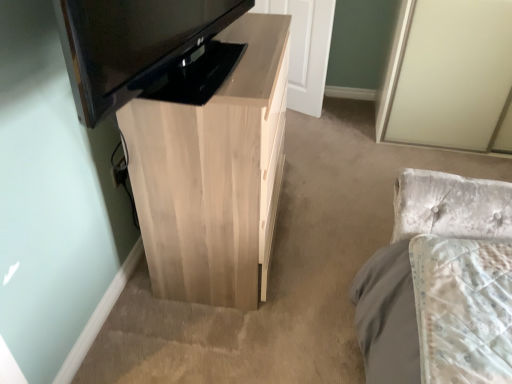
In order to face light wood cabinet at center, should I rotate leftwards or rightwards?

Turn left by 4.612 degrees to look at light wood cabinet at center.

The height and width of the screenshot is (384, 512). Identify the location of light wood cabinet at center. (214, 174).

Between white wood door at center and black glossy television at upper left, which one appears on the left side from the viewer's perspective?

Positioned to the left is black glossy television at upper left.

Is white wood door at center outside of black glossy television at upper left?

Yes, white wood door at center is located beyond the bounds of black glossy television at upper left.

Is white wood door at center taller than black glossy television at upper left?

Correct, white wood door at center is much taller as black glossy television at upper left.

Does point (305, 97) come behind point (133, 52)?

Yes, point (305, 97) is farther from viewer.

From the picture: Can light wood cabinet at center be found inside white wood door at center?

That's incorrect, light wood cabinet at center is not inside white wood door at center.

Is white wood door at center facing away from light wood cabinet at center?

white wood door at center does not have its back to light wood cabinet at center.

From a real-world perspective, is white wood door at center positioned over light wood cabinet at center based on gravity?

No, from a real-world perspective, white wood door at center is not above light wood cabinet at center.

Based on their sizes in the image, would you say light wood cabinet at center is bigger or smaller than white wood door at center?

Clearly, light wood cabinet at center is larger in size than white wood door at center.

From the image's perspective, does light wood cabinet at center appear higher than white wood door at center?

No, from the image's perspective, light wood cabinet at center is not over white wood door at center.

Considering the positions of points (222, 109) and (309, 37), is point (222, 109) farther from camera compared to point (309, 37)?

That is False.

Could white wood door at center be considered to be inside light wood cabinet at center?

No, white wood door at center is not inside light wood cabinet at center.

Based on the photo, is black glossy television at upper left positioned far away from white wood door at center?

black glossy television at upper left is far away from white wood door at center.

Is black glossy television at upper left positioned with its back to white wood door at center?

No, black glossy television at upper left is not facing the opposite direction of white wood door at center.

Does black glossy television at upper left have a greater height compared to white wood door at center?

No.

Which of these two, black glossy television at upper left or white wood door at center, is bigger?

black glossy television at upper left.

Which is closer, (x=242, y=180) or (x=71, y=57)?

Point (x=242, y=180) is farther from the camera than point (x=71, y=57).

Identify the location of television on the left of light wood cabinet at center. The width and height of the screenshot is (512, 384). (132, 45).

How distant is light wood cabinet at center from black glossy television at upper left?

light wood cabinet at center and black glossy television at upper left are 14.52 inches apart from each other.

Is light wood cabinet at center far from black glossy television at upper left?

No, light wood cabinet at center is not far from black glossy television at upper left.

From a real-world perspective, is black glossy television at upper left below light wood cabinet at center?

No, from a real-world perspective, black glossy television at upper left is not below light wood cabinet at center.

This screenshot has width=512, height=384. Identify the location of table to the right of black glossy television at upper left. (214, 174).

Is black glossy television at upper left at the right side of light wood cabinet at center?

Incorrect, black glossy television at upper left is not on the right side of light wood cabinet at center.

How much distance is there between black glossy television at upper left and light wood cabinet at center?

black glossy television at upper left and light wood cabinet at center are 14.52 inches apart from each other.

This screenshot has width=512, height=384. Find the location of `television below the white wood door at center (from the image's perspective)`. television below the white wood door at center (from the image's perspective) is located at coordinates (132, 45).

Locate an element on the screen. The width and height of the screenshot is (512, 384). door beneath the light wood cabinet at center (from a real-world perspective) is located at coordinates (305, 49).

When comparing their distances from light wood cabinet at center, does white wood door at center or black glossy television at upper left seem further?

white wood door at center is positioned further to the anchor light wood cabinet at center.

From the image, which object appears to be nearer to black glossy television at upper left, light wood cabinet at center or white wood door at center?

light wood cabinet at center is positioned closer to the anchor black glossy television at upper left.

Considering their positions, is black glossy television at upper left positioned further to light wood cabinet at center than white wood door at center?

white wood door at center.

Considering their positions, is light wood cabinet at center positioned further to white wood door at center than black glossy television at upper left?

black glossy television at upper left lies further to white wood door at center than the other object.

When comparing their distances from black glossy television at upper left, does white wood door at center or light wood cabinet at center seem further?

The object further to black glossy television at upper left is white wood door at center.

Based on their spatial positions, is black glossy television at upper left or light wood cabinet at center closer to white wood door at center?

light wood cabinet at center.

Identify the location of table between black glossy television at upper left and white wood door at center along the z-axis. (214, 174).